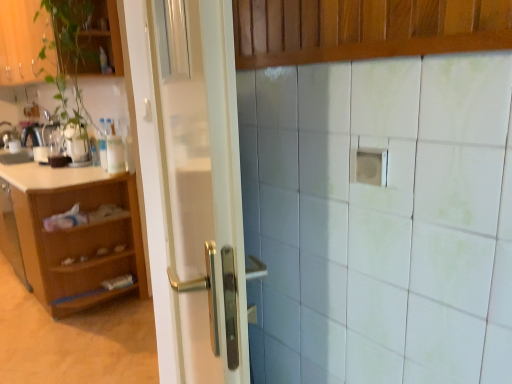
You are a GUI agent. You are given a task and a screenshot of the screen. Output one action in this format:
    pyautogui.click(x=<x>, y=<y>)
    Task: Click on the free spot to the left of white glossy pot at left
    Image resolution: width=512 pixels, height=384 pixels.
    Given the screenshot: What is the action you would take?
    pyautogui.click(x=50, y=166)